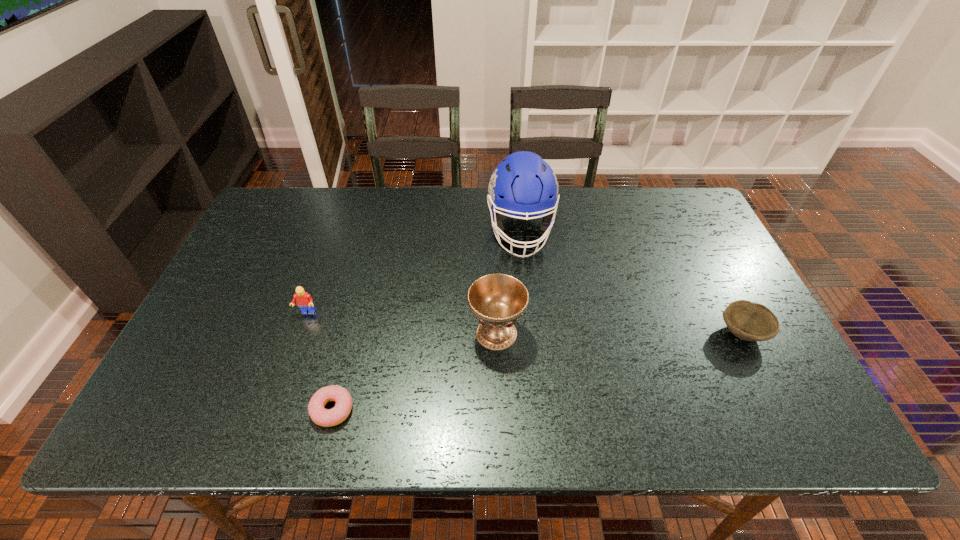
The image size is (960, 540). Identify the location of vacant space positioned on the front of the chalice. (499, 436).

Locate an element on the screen. The width and height of the screenshot is (960, 540). blank area located on the front-facing side of the third tallest object is located at coordinates (294, 350).

Where is `vacant position located on the back of the rightmost object`? vacant position located on the back of the rightmost object is located at coordinates (689, 230).

This screenshot has height=540, width=960. I want to click on free space located on the right of the nearest object, so click(490, 410).

The width and height of the screenshot is (960, 540). What are the coordinates of `object located at the far edge` in the screenshot? It's located at (523, 184).

I want to click on object that is at the near edge, so click(x=323, y=417).

What are the coordinates of `object positioned at the right edge` in the screenshot? It's located at (749, 321).

Where is `vacant area at the far edge of the desktop`? The image size is (960, 540). vacant area at the far edge of the desktop is located at coordinates point(362,197).

Where is `free location at the near edge`? This screenshot has height=540, width=960. free location at the near edge is located at coordinates (691, 434).

Identify the location of free location at the left edge. Image resolution: width=960 pixels, height=540 pixels. (296, 246).